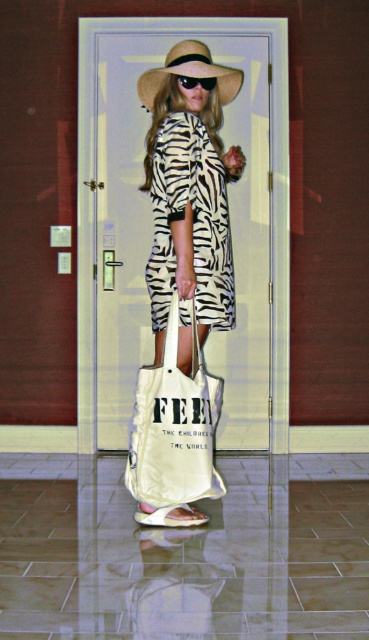
You are a fashion designer observing the person in the scene. You need to determine which item is taller between the beige fabric sandal at lower center and the black plastic goggles at center. Which one is taller?

The beige fabric sandal at lower center is taller than the black plastic goggles at center.

You are a fashion designer creating a new collection inspired by the image. You need to decide which item to feature first based on their sizes. Which object is wider, the beige fabric sandal at lower center or the black plastic goggles at center?

The beige fabric sandal at lower center is wider than the black plastic goggles at center according to the description.